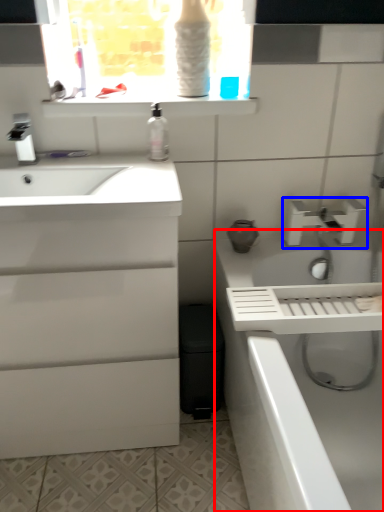
Question: Which of the following is the farthest to the observer, bath (highlighted by a red box) or tap (highlighted by a blue box)?

Choices:
 (A) bath
 (B) tap

Answer: (B)